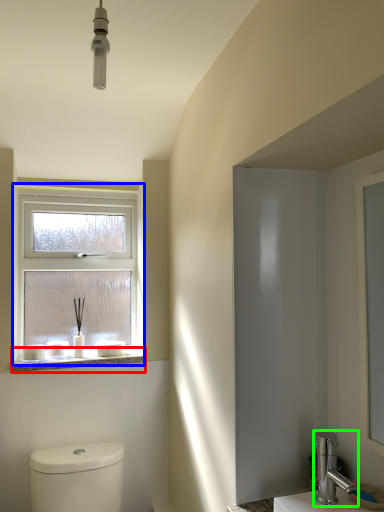
Question: Estimate the real-world distances between objects in this image. Which object is farther from window sill (highlighted by a red box), window (highlighted by a blue box) or tap (highlighted by a green box)?

Choices:
 (A) window
 (B) tap

Answer: (B)